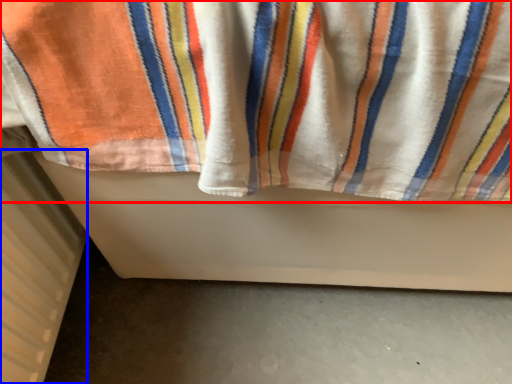
Question: Among these objects, which one is nearest to the camera, towel (highlighted by a red box) or radiator (highlighted by a blue box)?

Choices:
 (A) towel
 (B) radiator

Answer: (A)